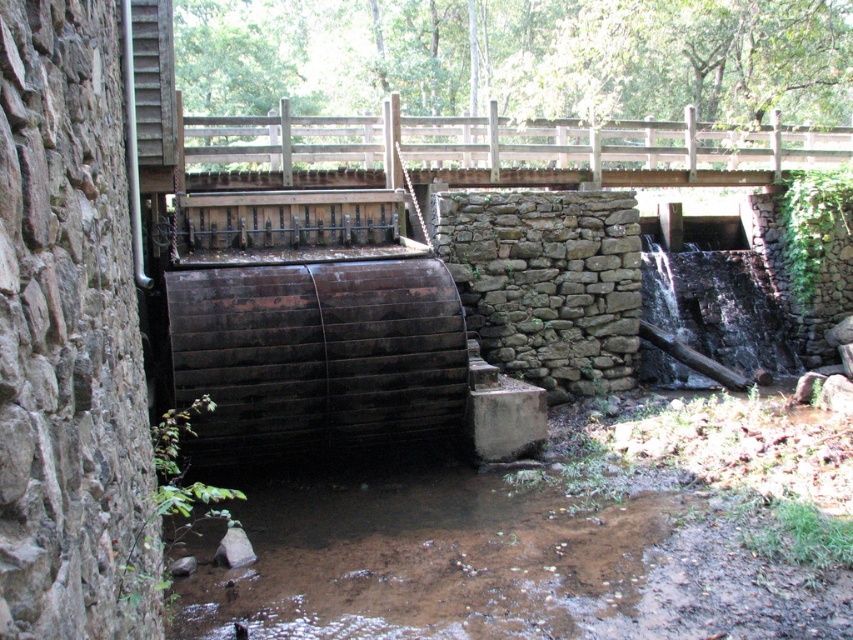
You are a hiker who just arrived at the waterwheel site. You see the brown muddy water at lower center and the wooden bridge at upper center. Which object is closer to the left side of your view?

The brown muddy water at lower center is to the left of the wooden bridge at upper center, so it is closer to the left side of the view.

You are a hiker who wants to cross the stream using the wooden bridge at upper center. However, you notice the brown muddy water at lower center. Considering the water levels, can you safely cross the bridge?

The brown muddy water at lower center has a smaller width than the wooden bridge at upper center, which suggests the water level is lower than the bridge. Therefore, it is safe to cross the wooden bridge at upper center.